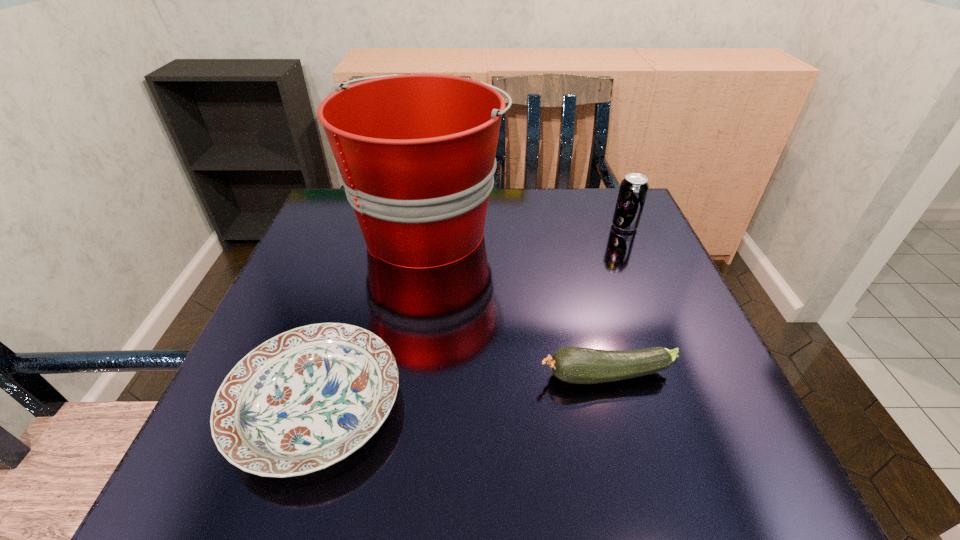
I want to click on free space between the third shortest object and the tallest object, so click(x=526, y=228).

Image resolution: width=960 pixels, height=540 pixels. In order to click on unoccupied area between the second shortest object and the shortest object in this screenshot , I will do `click(462, 391)`.

Locate an element on the screen. Image resolution: width=960 pixels, height=540 pixels. vacant point located between the third tallest object and the plate is located at coordinates (462, 391).

This screenshot has height=540, width=960. I want to click on empty location between the plate and the soda can, so click(x=470, y=316).

Locate an element on the screen. This screenshot has width=960, height=540. free space between the plate and the tallest object is located at coordinates (372, 318).

Locate an element on the screen. Image resolution: width=960 pixels, height=540 pixels. empty location between the second shortest object and the tallest object is located at coordinates (517, 303).

The width and height of the screenshot is (960, 540). I want to click on free space between the tallest object and the soda can, so click(526, 228).

At what (x,y) coordinates should I click in order to perform the action: click on object that is the third closest to the zucchini. Please return your answer as a coordinate pair (x, y). The height and width of the screenshot is (540, 960). Looking at the image, I should click on click(x=633, y=190).

Identify which object is the nearest to the soda can. Please provide its 2D coordinates. Your answer should be formatted as a tuple, i.e. [(x, y)], where the tuple contains the x and y coordinates of a point satisfying the conditions above.

[(416, 153)]

Find the location of a particular element. This screenshot has height=540, width=960. free space in the image that satisfies the following two spatial constraints: 1. at the blossom end of the zucchini; 2. on the front side of the shortest object is located at coordinates (614, 406).